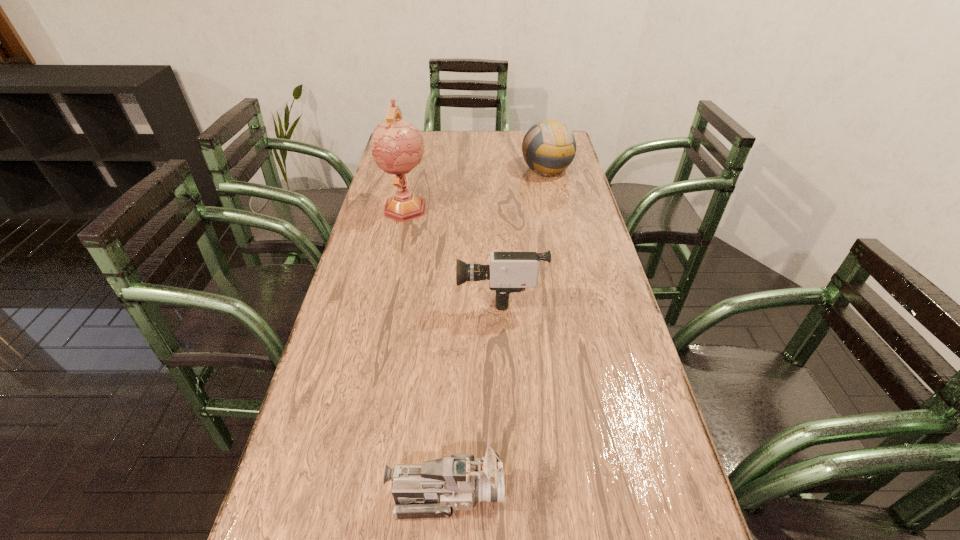
This screenshot has height=540, width=960. In order to click on object that is the second closest to the nearer camcorder in this screenshot , I will do `click(397, 146)`.

What are the coordinates of `object that is the nearest to the third farthest object` in the screenshot? It's located at (397, 146).

Image resolution: width=960 pixels, height=540 pixels. I want to click on free region that satisfies the following two spatial constraints: 1. on the front side of the farthest object; 2. on the front-facing side of the shortest object, so click(x=618, y=494).